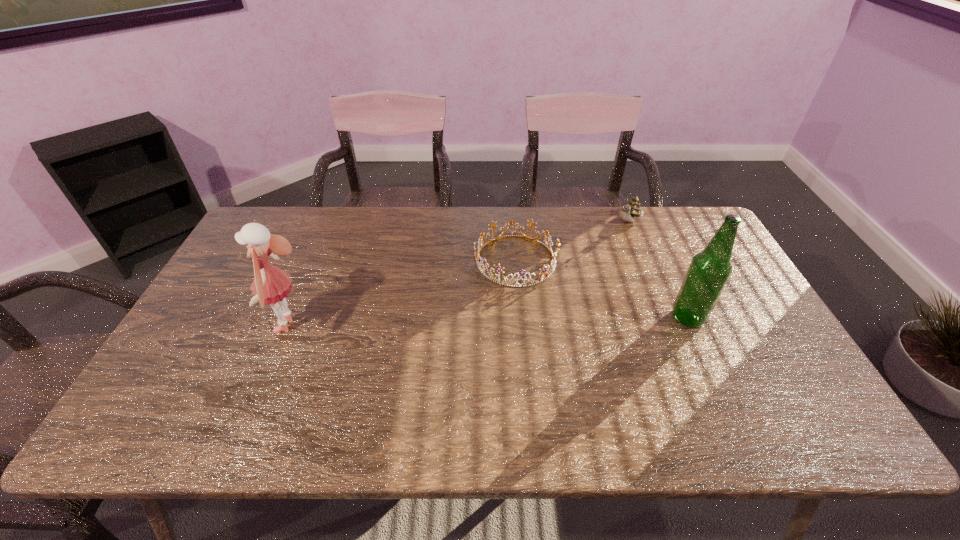
Locate an element on the screen. The width and height of the screenshot is (960, 540). free spot on the desktop that is between the doll and the beer bottle and is positioned on the front-facing side of the shortest object is located at coordinates (474, 322).

Locate an element on the screen. The width and height of the screenshot is (960, 540). free space on the desktop that is between the leftmost object and the beer bottle and is positioned on the face of the snail is located at coordinates (x=545, y=321).